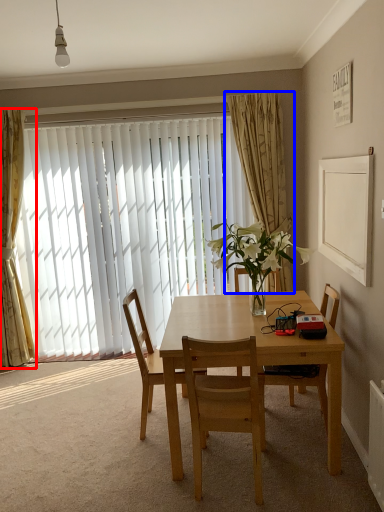
Question: Among these objects, which one is farthest to the camera, curtain (highlighted by a red box) or curtain (highlighted by a blue box)?

Choices:
 (A) curtain
 (B) curtain

Answer: (A)